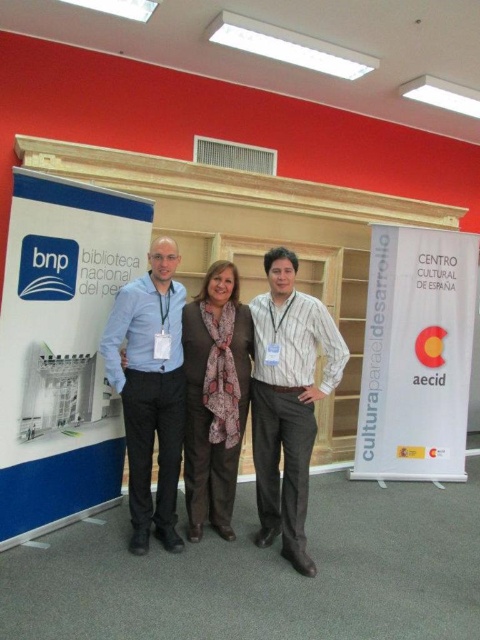
Measure the distance between point (308, 556) and camera.

Point (308, 556) and camera are 9.75 feet apart.

Does striped cotton shirt at center have a greater width compared to matte blue shirt at center?

Yes, striped cotton shirt at center is wider than matte blue shirt at center.

Is point (313, 330) farther from viewer compared to point (137, 474)?

No, it is not.

Where is `striped cotton shirt at center`? striped cotton shirt at center is located at coordinates (288, 401).

Is white paper at center below matte blue shirt at center?

Incorrect, white paper at center is not positioned below matte blue shirt at center.

Which is behind, point (406, 480) or point (159, 458)?

Positioned behind is point (406, 480).

This screenshot has height=640, width=480. What are the coordinates of `white paper at center` in the screenshot? It's located at (417, 355).

Describe the element at coordinates (417, 355) in the screenshot. I see `white paper at center` at that location.

Does white paper at center lie in front of brown textured scarf at center?

No, it is behind brown textured scarf at center.

Find the location of a particular element. This screenshot has width=480, height=640. white paper at center is located at coordinates (417, 355).